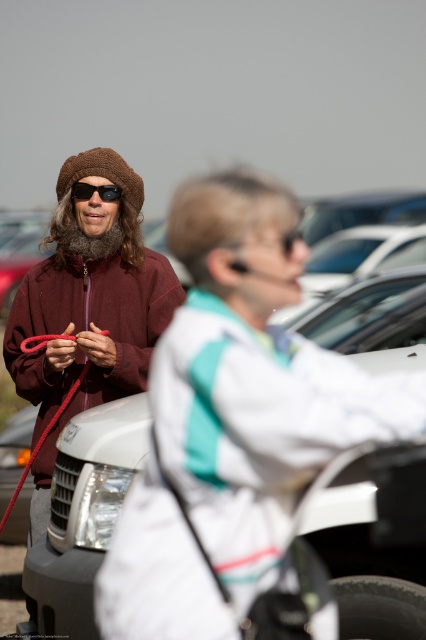
Question: Is matte brown hat at left in front of black matte sunglasses at upper left?

Choices:
 (A) no
 (B) yes

Answer: (B)

Question: Can you confirm if white glossy car at left is thinner than matte brown hat at left?

Choices:
 (A) yes
 (B) no

Answer: (A)

Question: Which object is farther from the camera taking this photo?

Choices:
 (A) matte brown hat at left
 (B) white glossy car at left

Answer: (B)

Question: Does matte brown hat at left lie in front of black matte sunglasses at upper left?

Choices:
 (A) no
 (B) yes

Answer: (B)

Question: Among these points, which one is nearest to the camera?

Choices:
 (A) (78, 374)
 (B) (103, 188)

Answer: (B)

Question: Which point is farther to the camera?

Choices:
 (A) (374, 321)
 (B) (80, 182)
 (C) (78, 317)

Answer: (A)